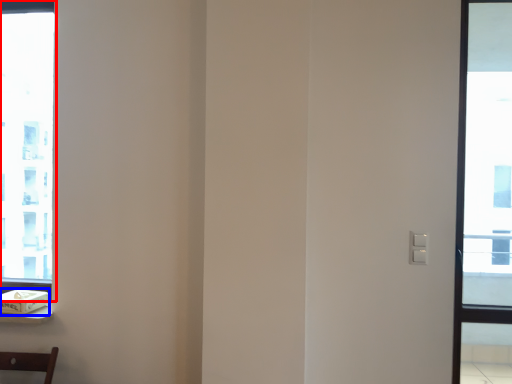
Question: Which object is closer to the camera taking this photo, window (highlighted by a red box) or box (highlighted by a blue box)?

Choices:
 (A) window
 (B) box

Answer: (B)